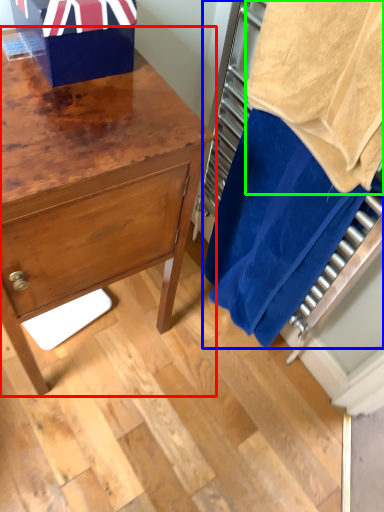
Question: Estimate the real-world distances between objects in this image. Which object is farther from chest of drawers (highlighted by a red box), laundry (highlighted by a blue box) or bath towel (highlighted by a green box)?

Choices:
 (A) laundry
 (B) bath towel

Answer: (B)